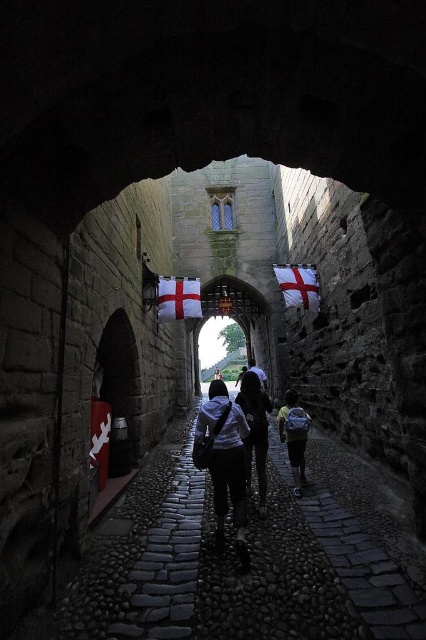
You are standing at the entrance of the castle and see the dark blue jeans at center and the white cotton flag at upper center. Which object is taller?

The dark blue jeans at center is much taller than the white cotton flag at upper center.